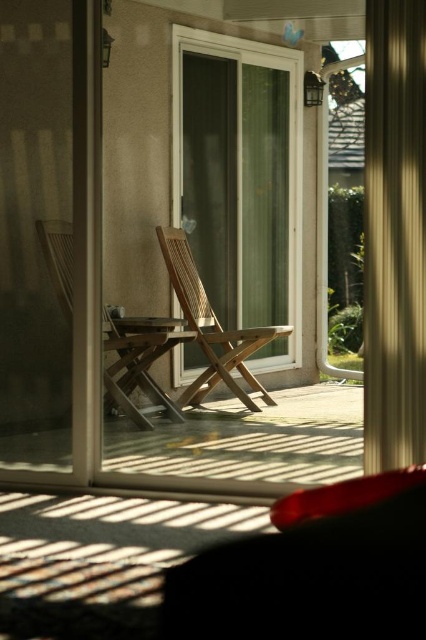
You are standing inside the house looking through the glass door. You want to move the wooden chair at center to the left side of the patio. Is the beige fabric curtain at right blocking your path?

The beige fabric curtain at right is positioned over the wooden chair at center, so moving the chair to the left would require adjusting the curtain first to clear the path.

Based on the photo, you are standing at the camera position looking at the outdoor patio through the glass door with vertical blinds. There is a point marked at coordinates point (242, 276). Can you reach that point without moving from your current position?

The point (242, 276) is 3.46 meters away from the camera, so yes, you can reach it without moving since it is within arm reach.